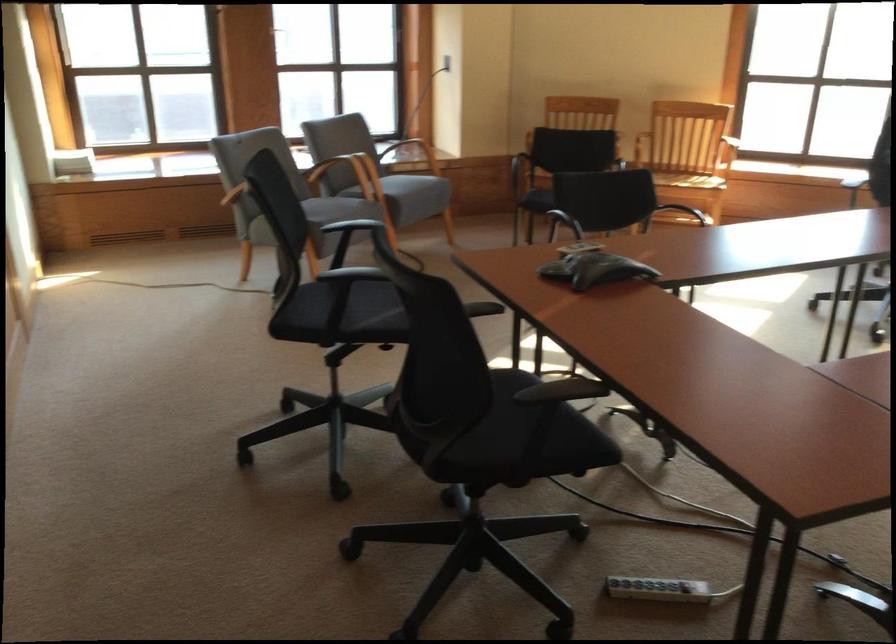
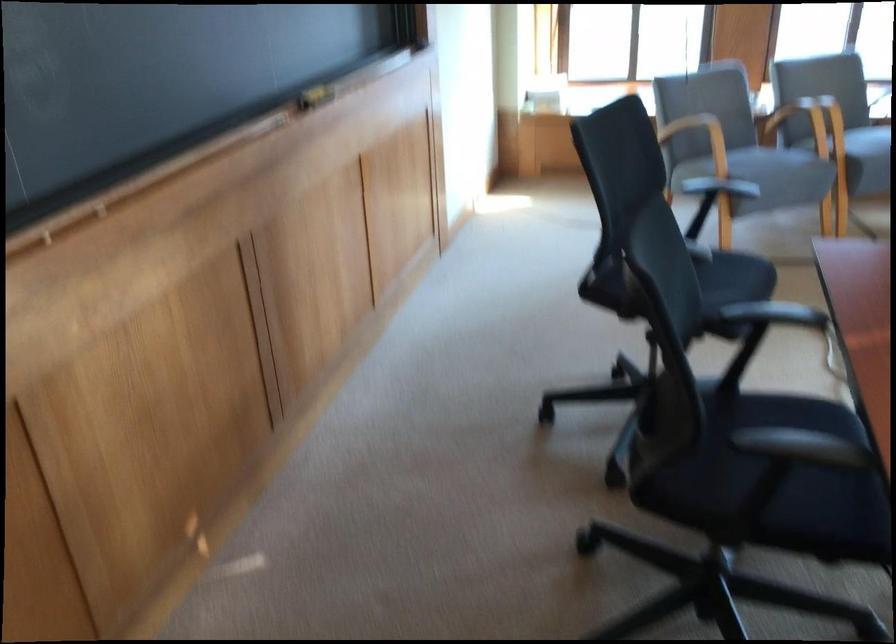
Question: The camera is either moving clockwise (left) or counter-clockwise (right) around the object. The first image is from the beginning of the video and the second image is from the end. Is the camera moving left or right when shooting the video?

Choices:
 (A) Left
 (B) Right

Answer: (B)